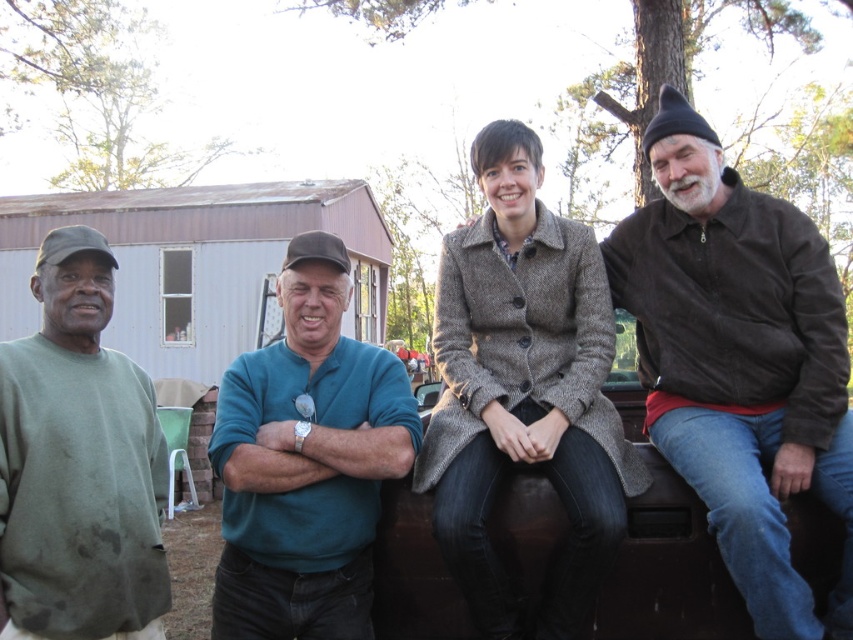
Is brown corduroy jacket at right shorter than green matte sweatshirt at left?

No.

The image size is (853, 640). Describe the element at coordinates (740, 362) in the screenshot. I see `brown corduroy jacket at right` at that location.

The image size is (853, 640). What are the coordinates of `brown corduroy jacket at right` in the screenshot? It's located at (740, 362).

Is teal fabric shirt at center above green matte sweatshirt at left?

Correct, teal fabric shirt at center is located above green matte sweatshirt at left.

Who is positioned more to the right, teal fabric shirt at center or green matte sweatshirt at left?

teal fabric shirt at center is more to the right.

I want to click on teal fabric shirt at center, so click(x=306, y=461).

Is brown corduroy jacket at right to the right of brown woolen coat at center from the viewer's perspective?

Yes, brown corduroy jacket at right is to the right of brown woolen coat at center.

Does brown corduroy jacket at right appear under brown woolen coat at center?

Actually, brown corduroy jacket at right is above brown woolen coat at center.

Describe the element at coordinates (740, 362) in the screenshot. I see `brown corduroy jacket at right` at that location.

I want to click on brown corduroy jacket at right, so click(740, 362).